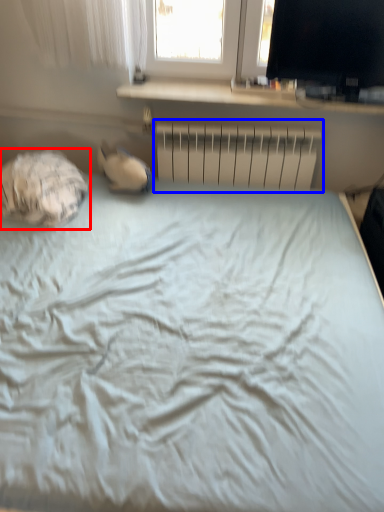
Question: Among these objects, which one is nearest to the camera, sleeping bag (highlighted by a red box) or radiator (highlighted by a blue box)?

Choices:
 (A) sleeping bag
 (B) radiator

Answer: (A)